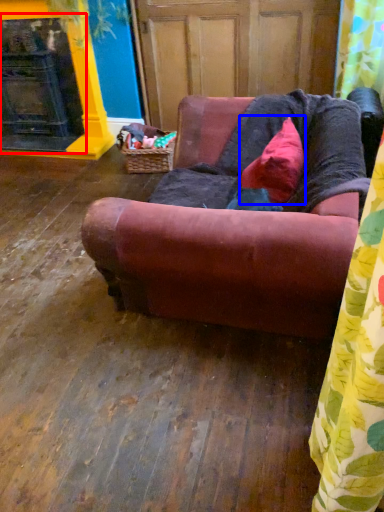
Question: Which point is closer to the camera, fireplace (highlighted by a red box) or pillow (highlighted by a blue box)?

Choices:
 (A) fireplace
 (B) pillow

Answer: (B)